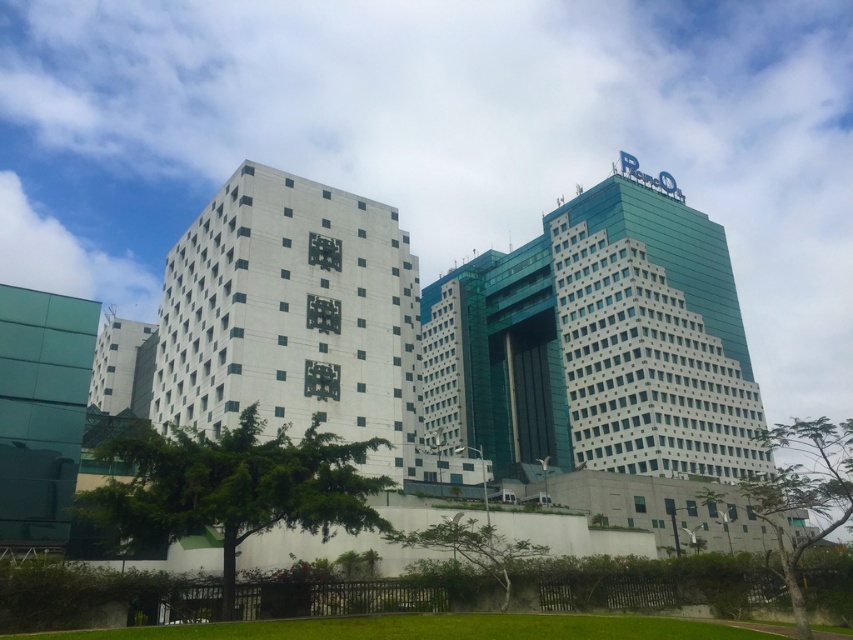
You are an urban planner assessing the space between two structures in the image. The white matte building at center and the green leafy tree at center are both in the central area. Which one has a greater horizontal span from left to right?

The white matte building at center has a greater horizontal span from left to right than the green leafy tree at center because its width surpasses the tree.

You are a delivery drone with a wingspan of 1.5 meters. You need to fly from the white matte building at center to the green leafy tree at center. Is there enough space between them for you to pass through?

The distance between the white matte building at center and the green leafy tree at center is 9.17 meters. Since your wingspan is only 1.5 meters, there is ample space for you to pass through the gap between them without any issues.